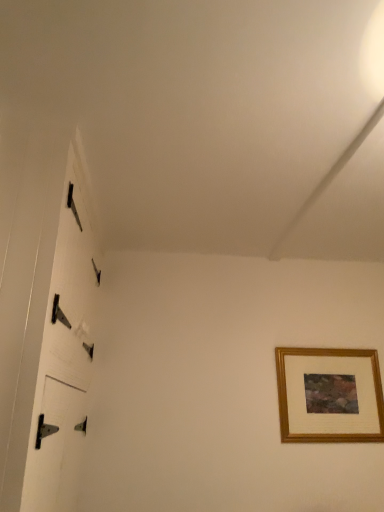
What do you see at coordinates (329, 395) in the screenshot?
I see `gold wooden picture frame at lower right` at bounding box center [329, 395].

Where is `gold wooden picture frame at lower right`? This screenshot has height=512, width=384. gold wooden picture frame at lower right is located at coordinates (329, 395).

In order to face metallic hinges at left, should I rotate leftwards or rightwards?

Rotate your view left by about 18.481°.

What is the approximate width of metallic hinges at left?

The width of metallic hinges at left is 10.95 inches.

Find the location of a particular element. This screenshot has height=512, width=384. metallic hinges at left is located at coordinates (58, 350).

The height and width of the screenshot is (512, 384). What do you see at coordinates (58, 350) in the screenshot?
I see `metallic hinges at left` at bounding box center [58, 350].

Locate an element on the screen. gold wooden picture frame at lower right is located at coordinates (329, 395).

Considering the positions of objects metallic hinges at left and gold wooden picture frame at lower right in the image provided, who is more to the right, metallic hinges at left or gold wooden picture frame at lower right?

From the viewer's perspective, gold wooden picture frame at lower right appears more on the right side.

Does metallic hinges at left come in front of gold wooden picture frame at lower right?

Yes, metallic hinges at left is in front of gold wooden picture frame at lower right.

Is point (55, 341) closer or farther from the camera than point (309, 428)?

Point (55, 341) appears to be closer to the viewer than point (309, 428).

From the image's perspective, does metallic hinges at left appear higher than gold wooden picture frame at lower right?

Yes, from the image's perspective, metallic hinges at left is above gold wooden picture frame at lower right.

In the scene shown: From a real-world perspective, between metallic hinges at left and gold wooden picture frame at lower right, who is vertically lower?

From a 3D spatial view, gold wooden picture frame at lower right is below.

Which object is thinner, metallic hinges at left or gold wooden picture frame at lower right?

With smaller width is gold wooden picture frame at lower right.

Between metallic hinges at left and gold wooden picture frame at lower right, which one has less height?

With less height is gold wooden picture frame at lower right.

Can you confirm if metallic hinges at left is smaller than gold wooden picture frame at lower right?

Actually, metallic hinges at left might be larger than gold wooden picture frame at lower right.

Is metallic hinges at left outside of gold wooden picture frame at lower right?

Yes, metallic hinges at left is not within gold wooden picture frame at lower right.

Would you say metallic hinges at left is a long distance from gold wooden picture frame at lower right?

Absolutely, metallic hinges at left is distant from gold wooden picture frame at lower right.

Is metallic hinges at left positioned with its back to gold wooden picture frame at lower right?

No.

The height and width of the screenshot is (512, 384). In order to click on door located on the left of gold wooden picture frame at lower right in this screenshot , I will do `click(58, 350)`.

In the image, is gold wooden picture frame at lower right on the left side or the right side of metallic hinges at left?

gold wooden picture frame at lower right is to the right of metallic hinges at left.

Considering their positions, is gold wooden picture frame at lower right located in front of or behind metallic hinges at left?

In the image, gold wooden picture frame at lower right appears behind metallic hinges at left.

Is point (300, 426) closer or farther from the camera than point (54, 259)?

Point (300, 426) is positioned farther from the camera compared to point (54, 259).

From the image's perspective, relative to metallic hinges at left, is gold wooden picture frame at lower right above or below?

gold wooden picture frame at lower right is situated lower than metallic hinges at left in the image.

From a real-world perspective, is gold wooden picture frame at lower right under metallic hinges at left?

Yes, from a real-world perspective, gold wooden picture frame at lower right is beneath metallic hinges at left.

Which object is wider, gold wooden picture frame at lower right or metallic hinges at left?

Wider between the two is metallic hinges at left.

Looking at this image, is gold wooden picture frame at lower right taller or shorter than metallic hinges at left?

Considering their sizes, gold wooden picture frame at lower right has less height than metallic hinges at left.

In the scene shown: Does gold wooden picture frame at lower right have a smaller size compared to metallic hinges at left?

Indeed, gold wooden picture frame at lower right has a smaller size compared to metallic hinges at left.

Is metallic hinges at left inside gold wooden picture frame at lower right?

No, metallic hinges at left is not surrounded by gold wooden picture frame at lower right.

Is gold wooden picture frame at lower right far from metallic hinges at left?

Absolutely, gold wooden picture frame at lower right is distant from metallic hinges at left.

Is gold wooden picture frame at lower right aimed at metallic hinges at left?

No, gold wooden picture frame at lower right is not facing towards metallic hinges at left.

Can you tell me how much gold wooden picture frame at lower right and metallic hinges at left differ in facing direction?

The angular difference between gold wooden picture frame at lower right and metallic hinges at left is 88.9 degrees.

Locate an element on the screen. The image size is (384, 512). door that is above the gold wooden picture frame at lower right (from a real-world perspective) is located at coordinates (58, 350).

The width and height of the screenshot is (384, 512). What are the coordinates of `door lying on the left of gold wooden picture frame at lower right` in the screenshot? It's located at pos(58,350).

Locate an element on the screen. The height and width of the screenshot is (512, 384). picture frame below the metallic hinges at left (from the image's perspective) is located at coordinates (329, 395).